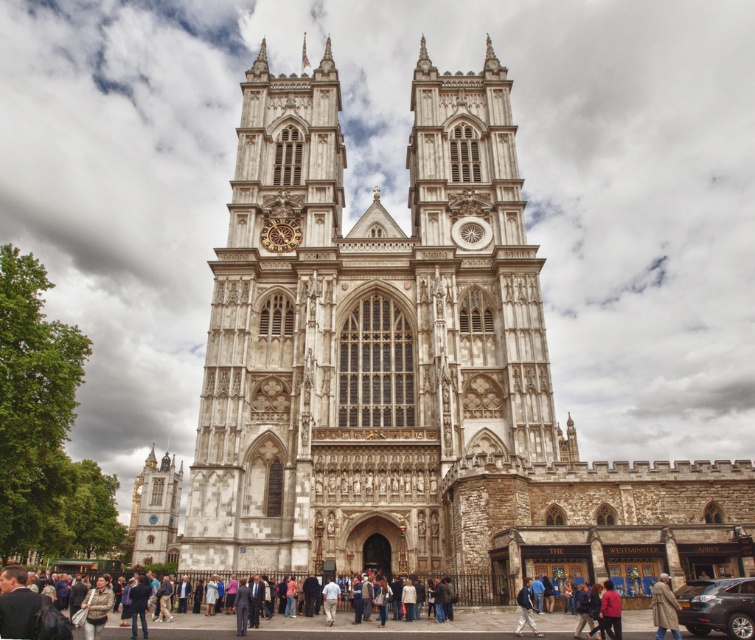
Is point (146, 490) less distant than point (658, 618)?

No, (146, 490) is further to viewer.

Who is higher up, stone clock tower at lower left or light brown leather coat at lower right?

light brown leather coat at lower right is higher up.

Is point (136, 545) farther from camera compared to point (673, 620)?

That is True.

The width and height of the screenshot is (755, 640). I want to click on stone clock tower at lower left, so click(x=156, y=509).

Is light brown leather coat at lower right below blue denim jacket at lower center?

No, light brown leather coat at lower right is not below blue denim jacket at lower center.

Does light brown leather coat at lower right have a smaller size compared to blue denim jacket at lower center?

Actually, light brown leather coat at lower right might be larger than blue denim jacket at lower center.

Locate an element on the screen. Image resolution: width=755 pixels, height=640 pixels. light brown leather coat at lower right is located at coordinates (664, 608).

Between point (165, 550) and point (515, 634), which one is positioned in front?

Point (515, 634)

Who is positioned more to the right, stone clock tower at lower left or blue denim jacket at lower center?

Positioned to the right is blue denim jacket at lower center.

In order to click on stone clock tower at lower left in this screenshot , I will do `click(156, 509)`.